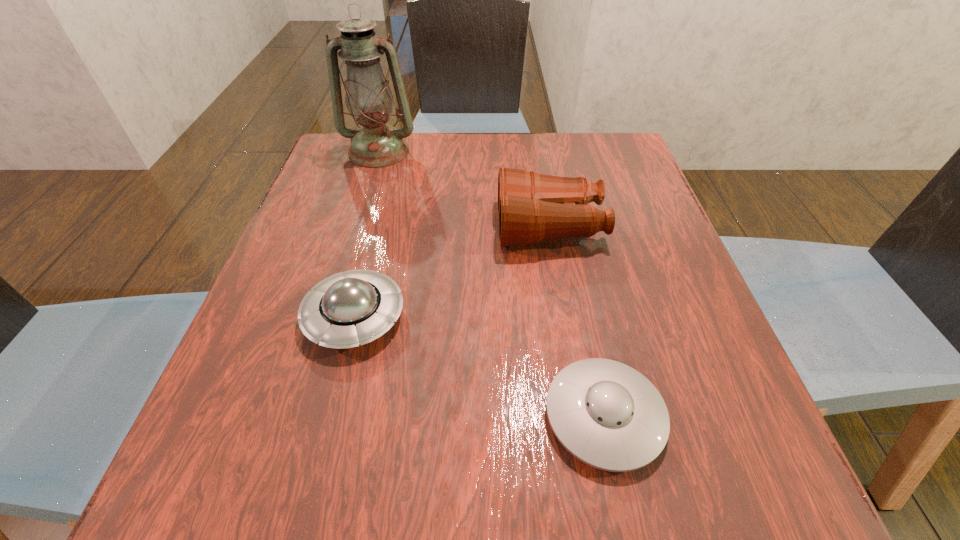
Where is `vacant space that satisfies the following two spatial constraints: 1. on the front side of the second shortest object; 2. on the right side of the tallest object`? The height and width of the screenshot is (540, 960). vacant space that satisfies the following two spatial constraints: 1. on the front side of the second shortest object; 2. on the right side of the tallest object is located at coordinates (328, 317).

Locate an element on the screen. The height and width of the screenshot is (540, 960). free location that satisfies the following two spatial constraints: 1. through the lenses of the binoculars; 2. on the left side of the nearest object is located at coordinates (583, 416).